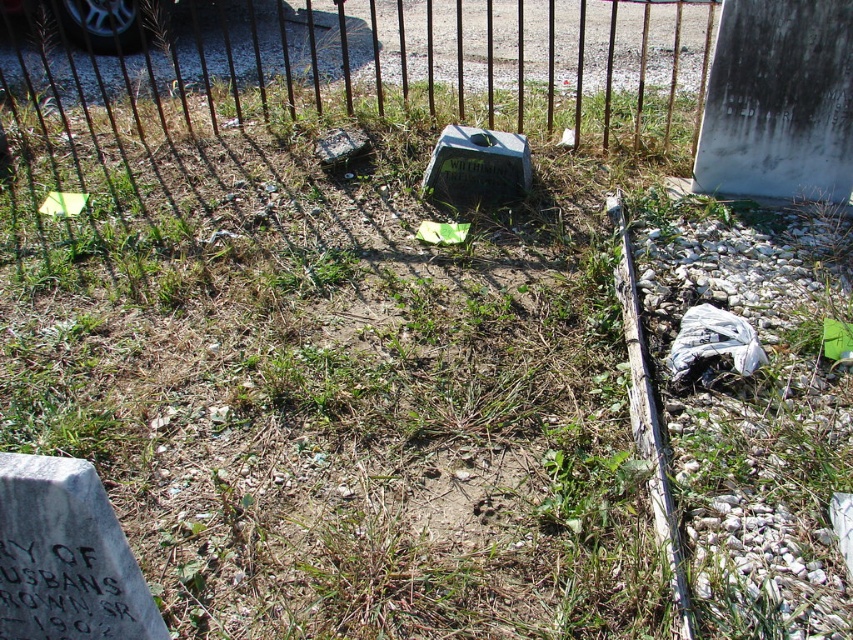
Can you confirm if green plastic gravestone at center is positioned to the right of white plastic bag at lower right?

Incorrect, green plastic gravestone at center is not on the right side of white plastic bag at lower right.

Can you confirm if green plastic gravestone at center is taller than white plastic bag at lower right?

Indeed, green plastic gravestone at center has a greater height compared to white plastic bag at lower right.

Which is behind, point (503, 168) or point (709, 348)?

Positioned behind is point (503, 168).

Where is `green plastic gravestone at center`? green plastic gravestone at center is located at coordinates (477, 166).

Is rusty metal fence at upper center closer to the viewer compared to rusty metal gravestone at center?

No, it is behind rusty metal gravestone at center.

Does rusty metal fence at upper center have a greater height compared to rusty metal gravestone at center?

Indeed, rusty metal fence at upper center has a greater height compared to rusty metal gravestone at center.

Find the location of a particular element. This screenshot has height=640, width=853. rusty metal fence at upper center is located at coordinates (361, 61).

Locate an element on the screen. Image resolution: width=853 pixels, height=640 pixels. rusty metal fence at upper center is located at coordinates (361, 61).

Consider the image. Who is taller, green plastic gravestone at center or rusty metal gravestone at center?

Standing taller between the two is green plastic gravestone at center.

Can you confirm if green plastic gravestone at center is thinner than rusty metal gravestone at center?

Incorrect, green plastic gravestone at center's width is not less than rusty metal gravestone at center's.

You are a GUI agent. You are given a task and a screenshot of the screen. Output one action in this format:
    pyautogui.click(x=<x>, y=<y>)
    Task: Click on the green plastic gravestone at center
    Image resolution: width=853 pixels, height=640 pixels.
    Given the screenshot: What is the action you would take?
    pyautogui.click(x=477, y=166)